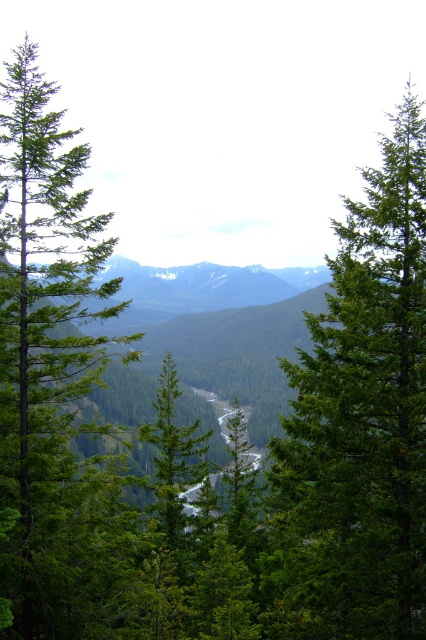
Question: Which object appears farthest from the camera in this image?

Choices:
 (A) green matte tree at left
 (B) green matte tree at center

Answer: (B)

Question: Is green matte tree at center further to camera compared to green matte tree at left?

Choices:
 (A) yes
 (B) no

Answer: (A)

Question: Which point is farther to the camera?

Choices:
 (A) green matte tree at left
 (B) green matte tree at center

Answer: (B)

Question: Does green matte tree at center appear on the left side of green matte tree at left?

Choices:
 (A) no
 (B) yes

Answer: (A)

Question: Is green matte tree at center above green matte tree at left?

Choices:
 (A) no
 (B) yes

Answer: (A)